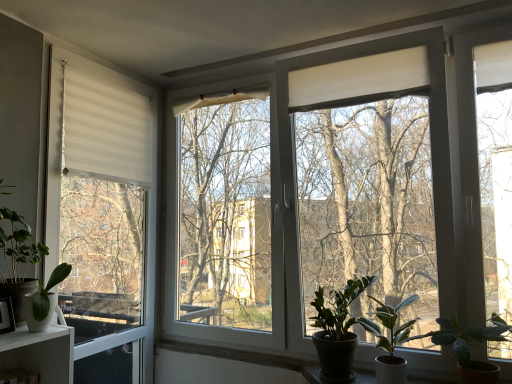
Where is `free spot above white matte window at left (from a real-world perspective)`? This screenshot has width=512, height=384. free spot above white matte window at left (from a real-world perspective) is located at coordinates (108, 68).